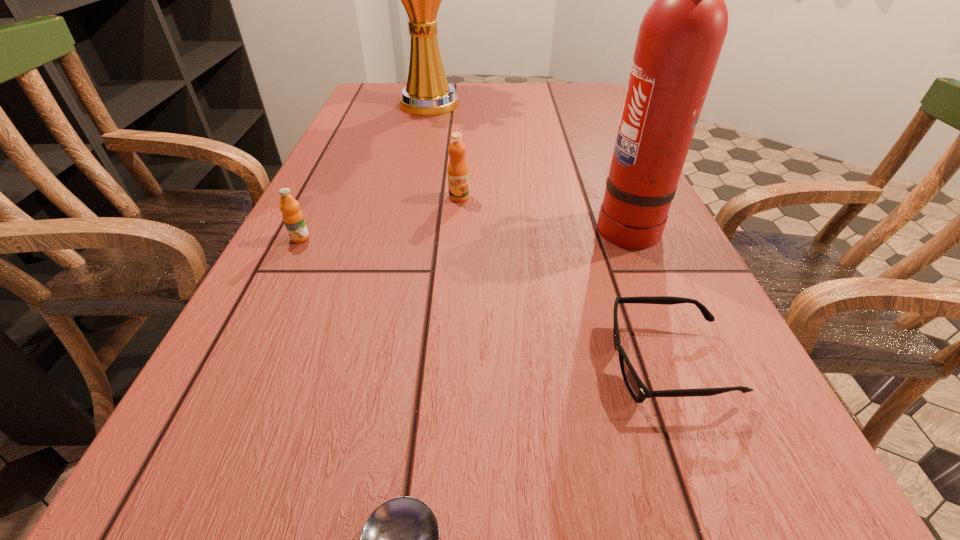
Where is `orange juice positioned at the left edge`? This screenshot has width=960, height=540. orange juice positioned at the left edge is located at coordinates (292, 216).

What are the coordinates of `fire extinguisher located in the right edge section of the desktop` in the screenshot? It's located at (680, 38).

This screenshot has width=960, height=540. Identify the location of sunglasses situated at the right edge. (639, 392).

At what (x,y) coordinates should I click in order to perform the action: click on object located in the far left corner section of the desktop. Please return your answer as a coordinate pair (x, y). Looking at the image, I should click on (427, 93).

Find the location of a particular element. Image resolution: width=960 pixels, height=540 pixels. vacant space at the left edge of the desktop is located at coordinates (359, 248).

Identify the location of vacant region at the right edge of the desktop. (581, 130).

Locate an element on the screen. free space at the far right corner is located at coordinates (589, 84).

The width and height of the screenshot is (960, 540). I want to click on free point between the fifth nearest object and the farthest object, so coord(444,151).

Where is `free spot between the third tallest object and the fifth shortest object`? free spot between the third tallest object and the fifth shortest object is located at coordinates coord(542,211).

The image size is (960, 540). Identify the location of unoccupied area between the fire extinguisher and the tallest object. [x=528, y=165].